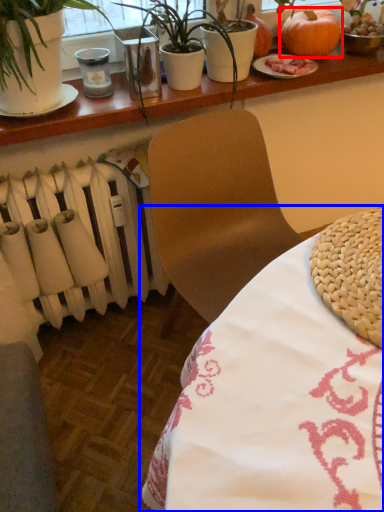
Question: Which point is further to the camera, pumpkin (highlighted by a red box) or table (highlighted by a blue box)?

Choices:
 (A) pumpkin
 (B) table

Answer: (A)